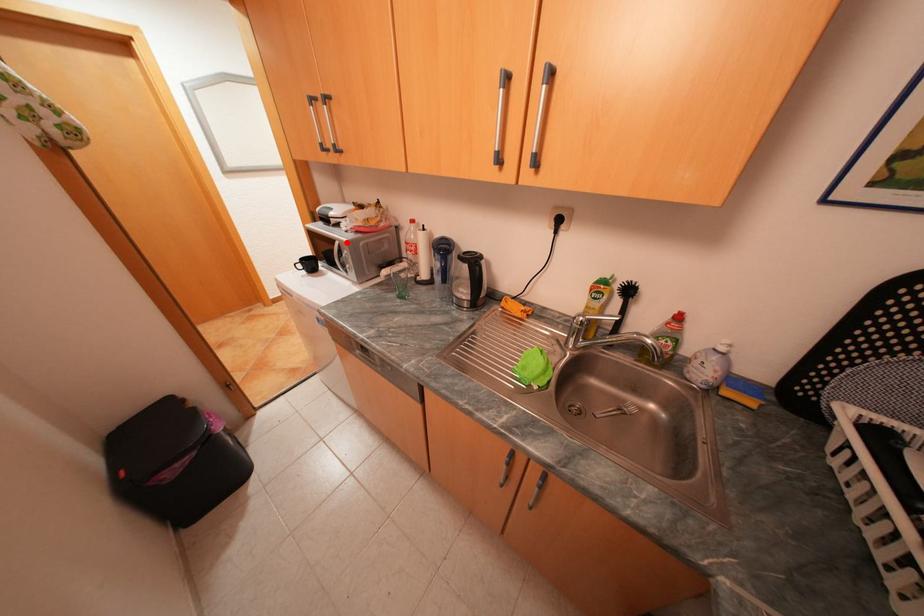
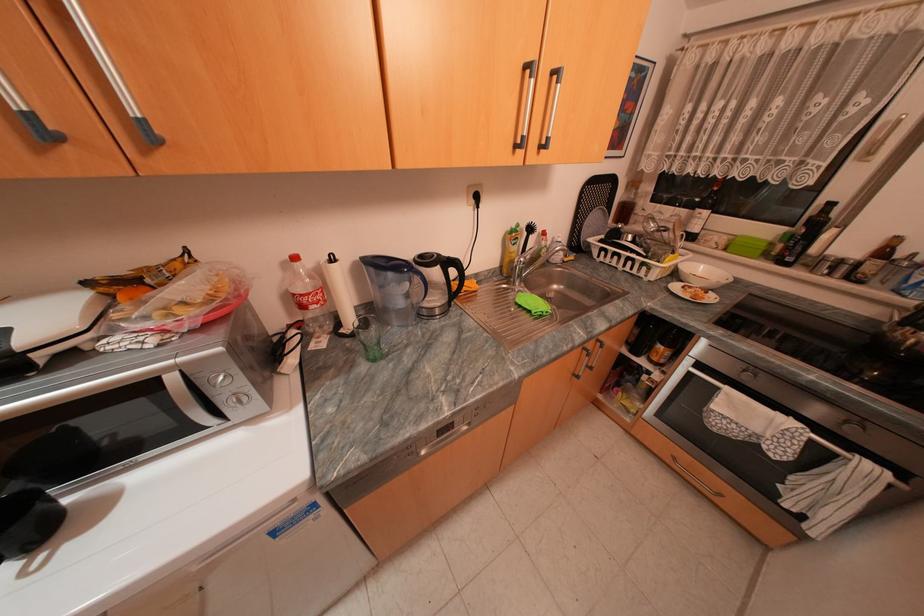
Find the pixel in the second image that matches the highlighted location in the first image.

(181, 378)